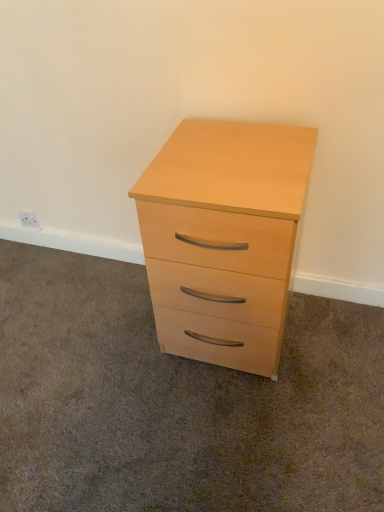
Find the location of a particular element. Image resolution: width=384 pixels, height=512 pixels. free region on the left part of light wood chest of drawers at center is located at coordinates (107, 337).